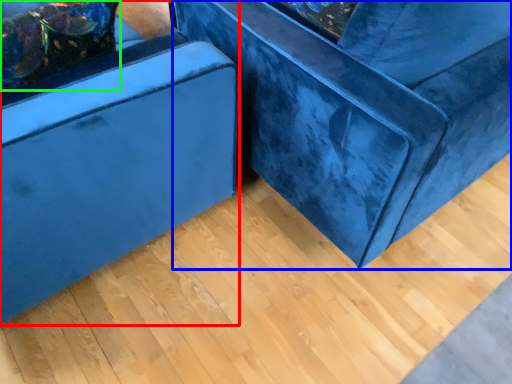
Question: Which is nearer to the furniture (highlighted by a red box)? furniture (highlighted by a blue box) or pillow (highlighted by a green box).

Choices:
 (A) furniture
 (B) pillow

Answer: (B)